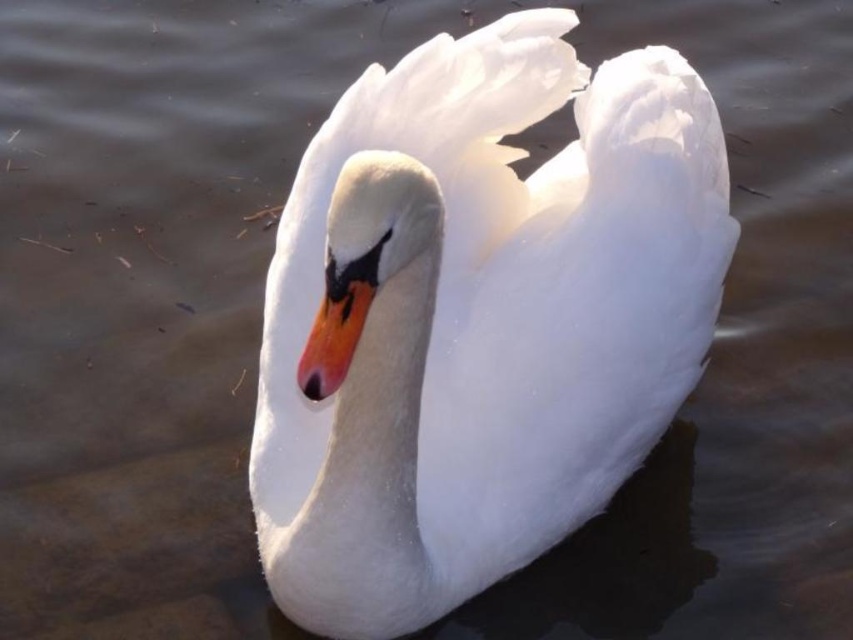
Between white glossy swan at center and orange glossy beak at center, which one appears on the left side from the viewer's perspective?

orange glossy beak at center is more to the left.

What do you see at coordinates (482, 317) in the screenshot? I see `white glossy swan at center` at bounding box center [482, 317].

At what (x,y) coordinates should I click in order to perform the action: click on white glossy swan at center. Please return your answer as a coordinate pair (x, y). Looking at the image, I should click on (482, 317).